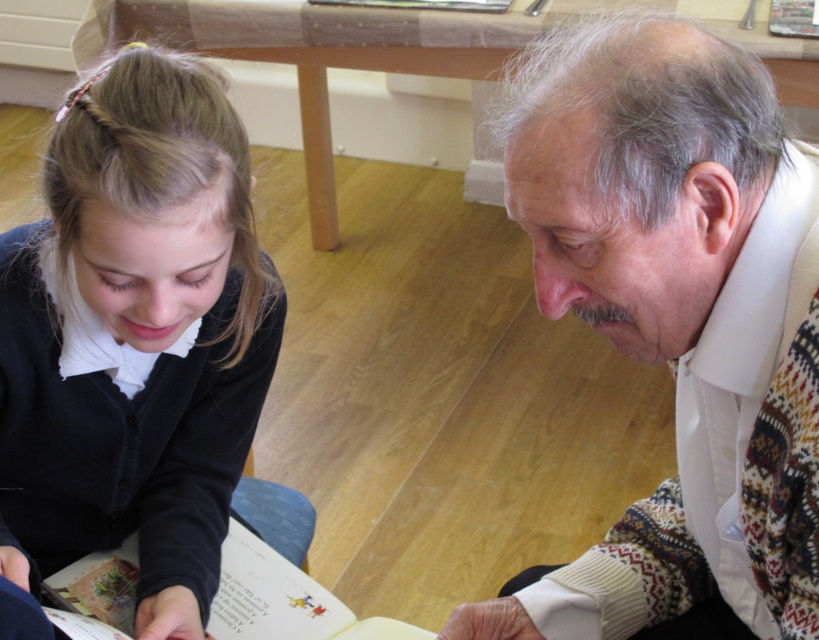
Can you confirm if white textured sweater at center is positioned above paper book at lower left?

Correct, white textured sweater at center is located above paper book at lower left.

Locate an element on the screen. This screenshot has height=640, width=819. white textured sweater at center is located at coordinates (676, 324).

The height and width of the screenshot is (640, 819). Identify the location of white textured sweater at center. (676, 324).

Who is more forward, (x=94, y=298) or (x=324, y=593)?

Positioned in front is point (x=94, y=298).

Is point (52, 145) behind point (250, 637)?

No, it is not.

Does point (197, 506) come in front of point (338, 621)?

No, (197, 506) is behind (338, 621).

Identify the location of black matte sweater at lower left. Image resolution: width=819 pixels, height=640 pixels. (139, 342).

Does point (677, 484) lie in front of point (145, 346)?

That is False.

Locate an element on the screen. This screenshot has width=819, height=640. white textured sweater at center is located at coordinates (676, 324).